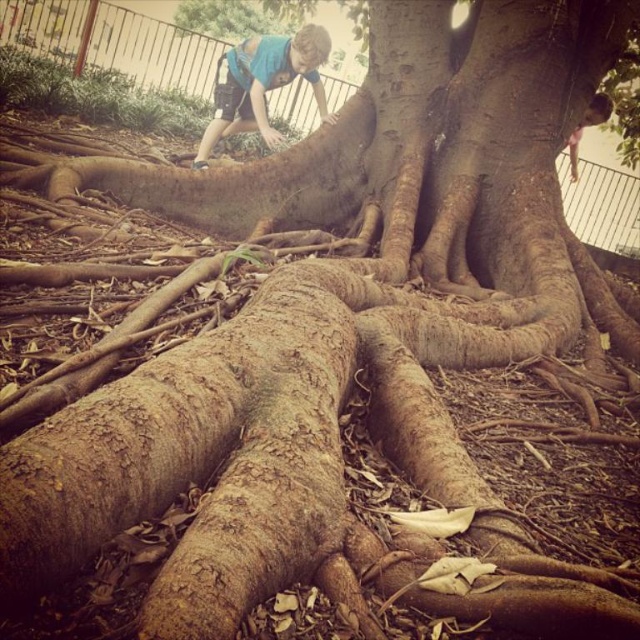
Can you confirm if blue cotton shirt at upper center is wider than brown textured hair at upper right?

Indeed, blue cotton shirt at upper center has a greater width compared to brown textured hair at upper right.

Who is lower down, blue cotton shirt at upper center or brown textured hair at upper right?

brown textured hair at upper right is lower down.

Which is behind, point (321, 92) or point (604, 100)?

Point (604, 100)

This screenshot has width=640, height=640. What are the coordinates of `blue cotton shirt at upper center` in the screenshot? It's located at (262, 83).